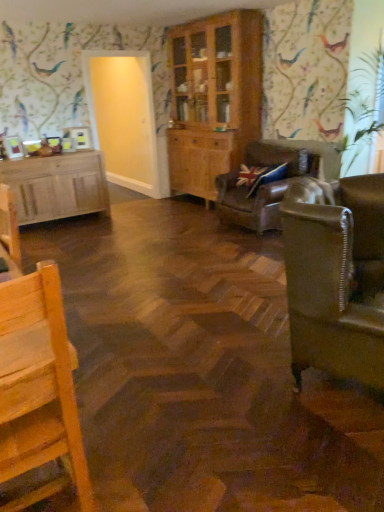
Question: Is leather sofa at center, the first studio couch viewed from the back, directly adjacent to transparent glass door at upper left?

Choices:
 (A) yes
 (B) no

Answer: (B)

Question: Is the position of leather sofa at center, the first studio couch viewed from the back, less distant than that of transparent glass door at upper left?

Choices:
 (A) yes
 (B) no

Answer: (A)

Question: Is leather sofa at center, the first studio couch viewed from the back, oriented towards transparent glass door at upper left?

Choices:
 (A) no
 (B) yes

Answer: (A)

Question: Is transparent glass door at upper left located within leather sofa at center, the first studio couch viewed from the back?

Choices:
 (A) yes
 (B) no

Answer: (B)

Question: From a real-world perspective, does leather sofa at center, the first studio couch viewed from the back, stand above transparent glass door at upper left?

Choices:
 (A) yes
 (B) no

Answer: (B)

Question: Is point (125, 87) closer or farther from the camera than point (16, 422)?

Choices:
 (A) closer
 (B) farther

Answer: (B)

Question: Considering the positions of transparent glass door at upper left and wooden chair at lower left in the image, is transparent glass door at upper left bigger or smaller than wooden chair at lower left?

Choices:
 (A) small
 (B) big

Answer: (B)

Question: From their relative heights in the image, would you say transparent glass door at upper left is taller or shorter than wooden chair at lower left?

Choices:
 (A) tall
 (B) short

Answer: (A)

Question: Considering the positions of transparent glass door at upper left and wooden chair at lower left in the image, is transparent glass door at upper left wider or thinner than wooden chair at lower left?

Choices:
 (A) thin
 (B) wide

Answer: (A)

Question: Considering the relative positions of leather couch at right, positioned as the second studio couch in back-to-front order, and wooden cabinet at center, which is the 2th cabinetry from left to right, in the image provided, is leather couch at right, positioned as the second studio couch in back-to-front order, to the left or to the right of wooden cabinet at center, which is the 2th cabinetry from left to right,?

Choices:
 (A) right
 (B) left

Answer: (A)

Question: Considering their positions, is leather couch at right, which is the 1th studio couch from front to back, located in front of or behind wooden cabinet at center, arranged as the 1th cabinetry when viewed from the right?

Choices:
 (A) front
 (B) behind

Answer: (A)

Question: Is point (375, 311) positioned closer to the camera than point (208, 131)?

Choices:
 (A) closer
 (B) farther

Answer: (A)

Question: Is leather couch at right, which is the 1th studio couch from front to back, wider or thinner than wooden cabinet at center, arranged as the 1th cabinetry when viewed from the right?

Choices:
 (A) wide
 (B) thin

Answer: (A)

Question: In the image, is wooden cabinet at center, which is the 2th cabinetry from left to right, on the left side or the right side of wooden chair at lower left?

Choices:
 (A) left
 (B) right

Answer: (B)

Question: From the image's perspective, relative to wooden chair at lower left, is wooden cabinet at center, which is the 2th cabinetry from left to right, above or below?

Choices:
 (A) below
 (B) above

Answer: (B)